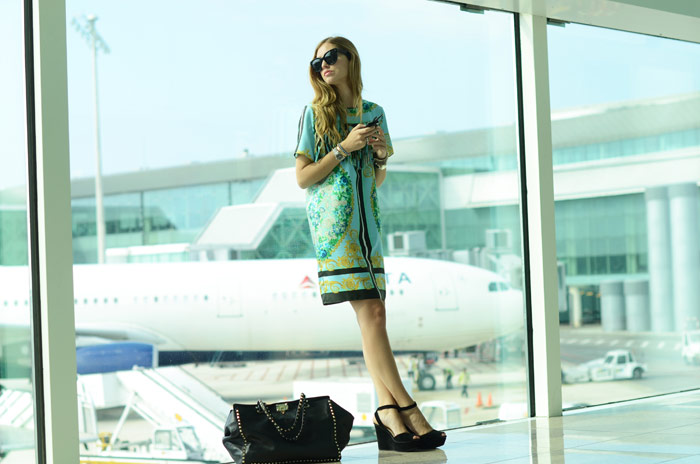
Locate an element on the screen. This screenshot has width=700, height=464. window is located at coordinates (175, 245), (642, 251), (8, 160), (182, 201), (120, 219), (239, 193), (601, 241).